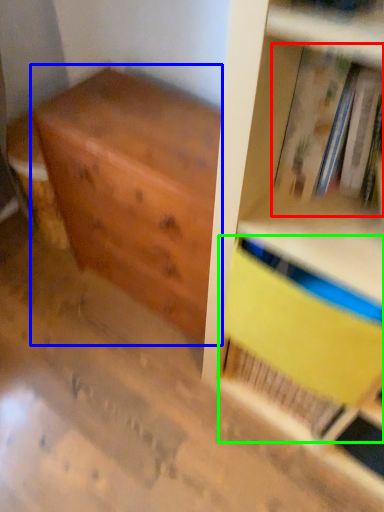
Question: Which object is the farthest from book (highlighted by a red box)? Choose among these: chest of drawers (highlighted by a blue box) or paperback book (highlighted by a green box).

Choices:
 (A) chest of drawers
 (B) paperback book

Answer: (A)